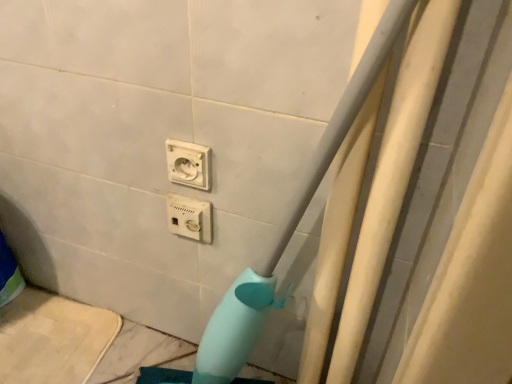
Question: Considering the positions of white plastic socket at center, placed as the 1th power plugs and sockets when sorted from top to bottom, and white plastic power plugs and sockets at center, the 1th power plugs and sockets positioned from the bottom, in the image, is white plastic socket at center, placed as the 1th power plugs and sockets when sorted from top to bottom, bigger or smaller than white plastic power plugs and sockets at center, the 1th power plugs and sockets positioned from the bottom,?

Choices:
 (A) big
 (B) small

Answer: (B)

Question: From the image's perspective, is white plastic socket at center, which ranks as the 2th power plugs and sockets in bottom-to-top order, positioned above or below white plastic power plugs and sockets at center, the 2th power plugs and sockets positioned from the top?

Choices:
 (A) below
 (B) above

Answer: (B)

Question: Considering the positions of white plastic socket at center, placed as the 1th power plugs and sockets when sorted from top to bottom, and white plastic power plugs and sockets at center, the 1th power plugs and sockets positioned from the bottom, in the image, is white plastic socket at center, placed as the 1th power plugs and sockets when sorted from top to bottom, wider or thinner than white plastic power plugs and sockets at center, the 1th power plugs and sockets positioned from the bottom,?

Choices:
 (A) wide
 (B) thin

Answer: (B)

Question: Is white plastic power plugs and sockets at center, the 2th power plugs and sockets positioned from the top, to the left or to the right of white plastic socket at center, which ranks as the 2th power plugs and sockets in bottom-to-top order, in the image?

Choices:
 (A) left
 (B) right

Answer: (A)

Question: Looking at their shapes, would you say white plastic power plugs and sockets at center, the 1th power plugs and sockets positioned from the bottom, is wider or thinner than white plastic socket at center, which ranks as the 2th power plugs and sockets in bottom-to-top order?

Choices:
 (A) wide
 (B) thin

Answer: (A)

Question: Considering the positions of white plastic power plugs and sockets at center, the 1th power plugs and sockets positioned from the bottom, and white plastic socket at center, which ranks as the 2th power plugs and sockets in bottom-to-top order, in the image, is white plastic power plugs and sockets at center, the 1th power plugs and sockets positioned from the bottom, bigger or smaller than white plastic socket at center, which ranks as the 2th power plugs and sockets in bottom-to-top order,?

Choices:
 (A) small
 (B) big

Answer: (B)

Question: From the image's perspective, relative to white plastic socket at center, which ranks as the 2th power plugs and sockets in bottom-to-top order, is white plastic power plugs and sockets at center, the 2th power plugs and sockets positioned from the top, above or below?

Choices:
 (A) above
 (B) below

Answer: (B)